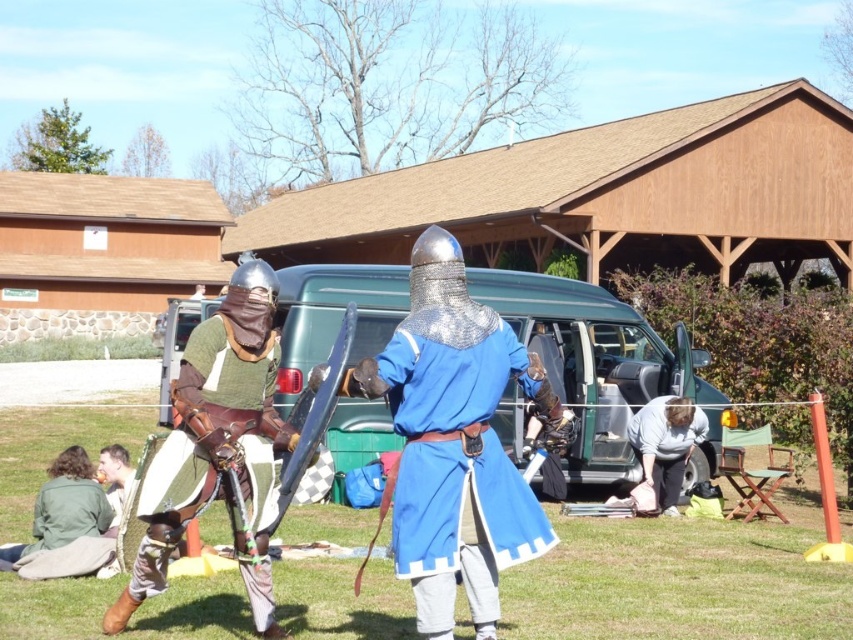
Based on the photo, you are a photographer at the medieval event and want to capture the two fighters. You notice two points marked in the scene. The first point is at coordinates point (523, 348) and the second is at point (54, 524). Which point is closer to you?

Point (523, 348) is closer to the viewer than point (54, 524).